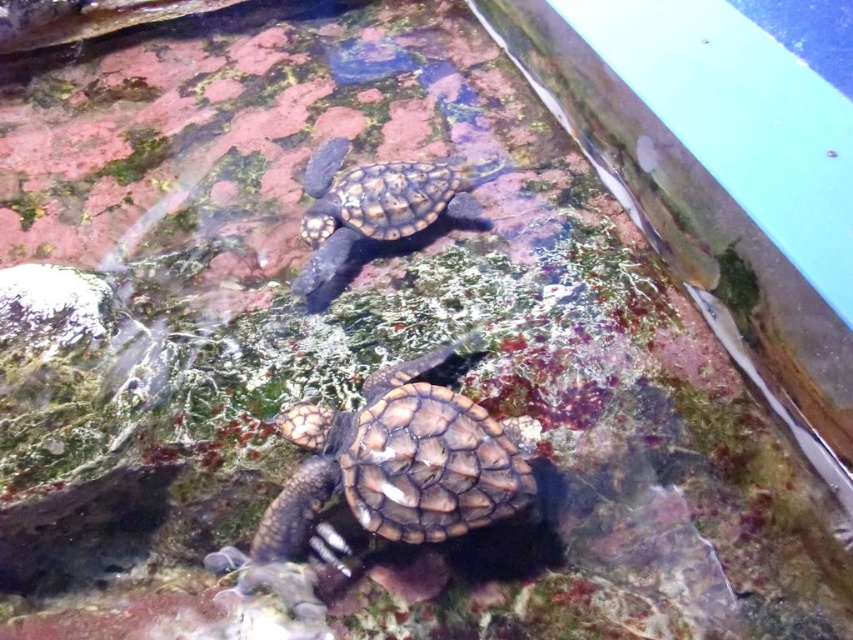
Question: Is brown scaly tortoise at center further to camera compared to leathery brown tortoise at upper center?

Choices:
 (A) no
 (B) yes

Answer: (A)

Question: Which point is farther to the camera?

Choices:
 (A) leathery brown tortoise at upper center
 (B) brown scaly tortoise at center

Answer: (A)

Question: Does brown scaly tortoise at center come in front of leathery brown tortoise at upper center?

Choices:
 (A) no
 (B) yes

Answer: (B)

Question: Considering the relative positions of brown scaly tortoise at center and leathery brown tortoise at upper center in the image provided, where is brown scaly tortoise at center located with respect to leathery brown tortoise at upper center?

Choices:
 (A) above
 (B) below

Answer: (B)

Question: Which point is closer to the camera taking this photo?

Choices:
 (A) (398, 472)
 (B) (461, 220)

Answer: (A)

Question: Which point appears closest to the camera in this image?

Choices:
 (A) (428, 392)
 (B) (416, 170)

Answer: (A)